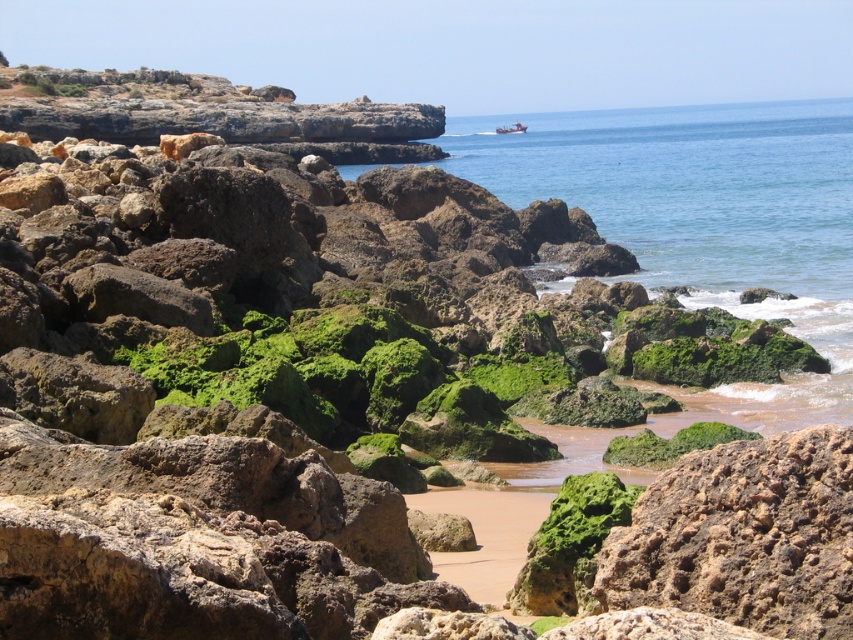
You are a hiker who wants to cross from the rocky area to the beach. You have a backpack with a width of 40 cm. The path between the green mossy rock at center and the metallic red boat at center is narrow. Can your backpack fit through the gap between them?

The green mossy rock at center is narrower than the metallic red boat at center. Since the backpack is 40 cm wide, it depends on the actual width of the gap. However, the description only states the rock is narrower than the boat, not the gap. Without specific gap measurements, we can only confirm the rock is smaller in width than the boat, but cannot determine backpack fit.

Consider the image. You are a photographer standing on the rocky coast and want to capture both the green mossy rock at center and the metallic red boat at center in the same frame. Which object should you focus on first to ensure both are in the shot?

The green mossy rock at center is positioned under the metallic red boat at center, so you should focus on the metallic red boat at center first to ensure both are in the shot.

You are a photographer planning to take a photo of the metallic red boat at center and the green mossy rock at center. Which object should you place on the left side of your frame to include both in the composition?

You should place the green mossy rock at center on the left side of your frame since it is already positioned on the left side of the metallic red boat at center.